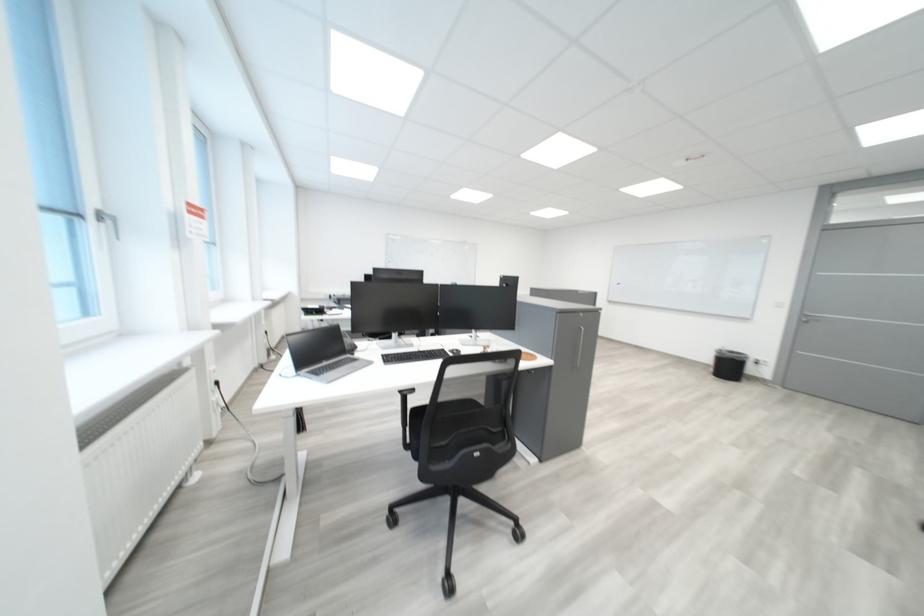
Which object does [455,352] point to?

It corresponds to the black computer mouse in the image.